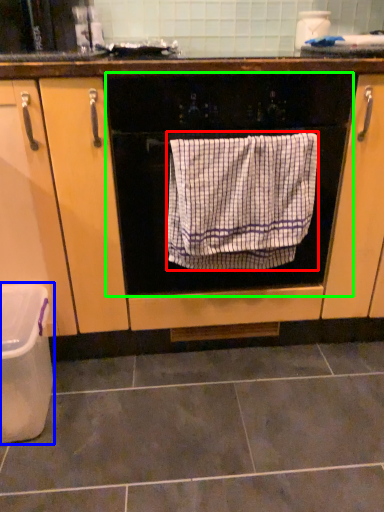
Question: Which object is the closest to the bath towel (highlighted by a red box)? Choose among these: dish washer (highlighted by a blue box) or oven (highlighted by a green box).

Choices:
 (A) dish washer
 (B) oven

Answer: (B)